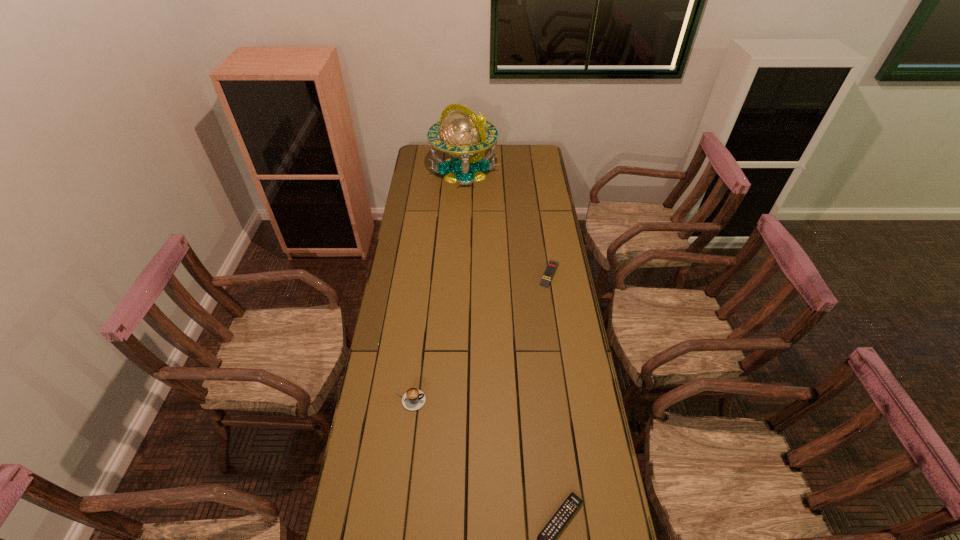
The width and height of the screenshot is (960, 540). In order to click on globe at the left edge in this screenshot , I will do `click(462, 133)`.

The width and height of the screenshot is (960, 540). Identify the location of cappuccino positioned at the left edge. (413, 399).

Image resolution: width=960 pixels, height=540 pixels. I want to click on object that is positioned at the right edge, so click(x=552, y=265).

Identify the location of object located in the far left corner section of the desktop. Image resolution: width=960 pixels, height=540 pixels. (462, 133).

This screenshot has width=960, height=540. I want to click on free space at the far edge of the desktop, so click(516, 161).

In order to click on free space at the left edge of the desktop in this screenshot , I will do `click(390, 294)`.

In the image, there is a desktop. Identify the location of vacant space at the right edge. Image resolution: width=960 pixels, height=540 pixels. (581, 343).

At what (x,y) coordinates should I click in order to perform the action: click on vacant area at the far left corner. Please return your answer as a coordinate pair (x, y). Looking at the image, I should click on (431, 166).

The width and height of the screenshot is (960, 540). Find the location of `vacant space at the far right corner of the desktop`. vacant space at the far right corner of the desktop is located at coordinates (529, 156).

Find the location of a particular element. The width and height of the screenshot is (960, 540). vacant point located between the farthest object and the taller remote control is located at coordinates (507, 222).